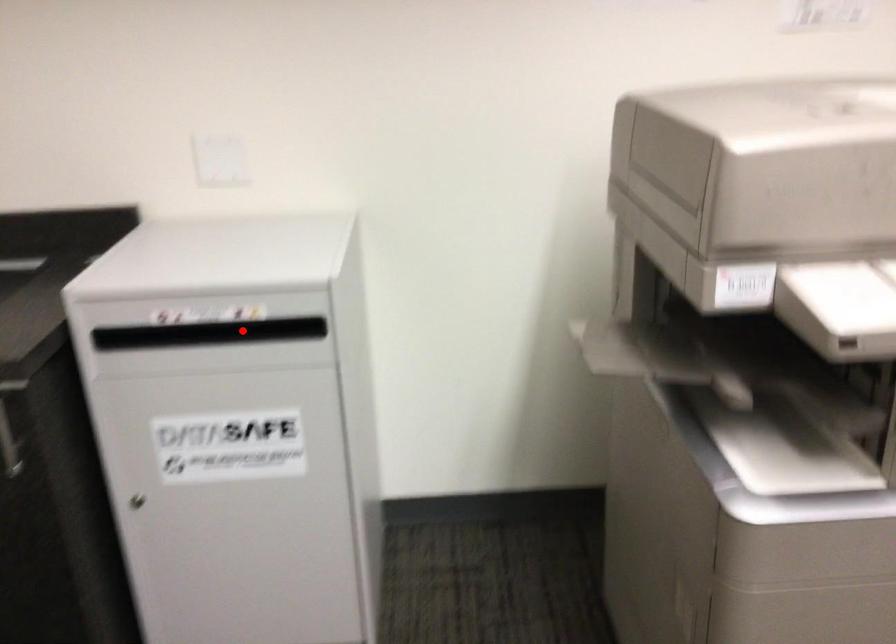
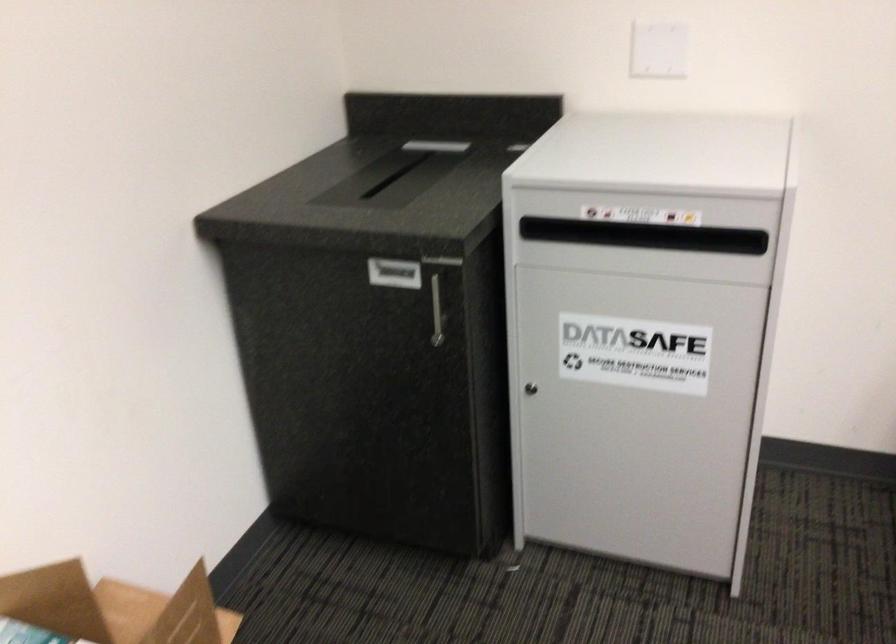
In the second image, find the point that corresponds to the highlighted location in the first image.

(644, 236)